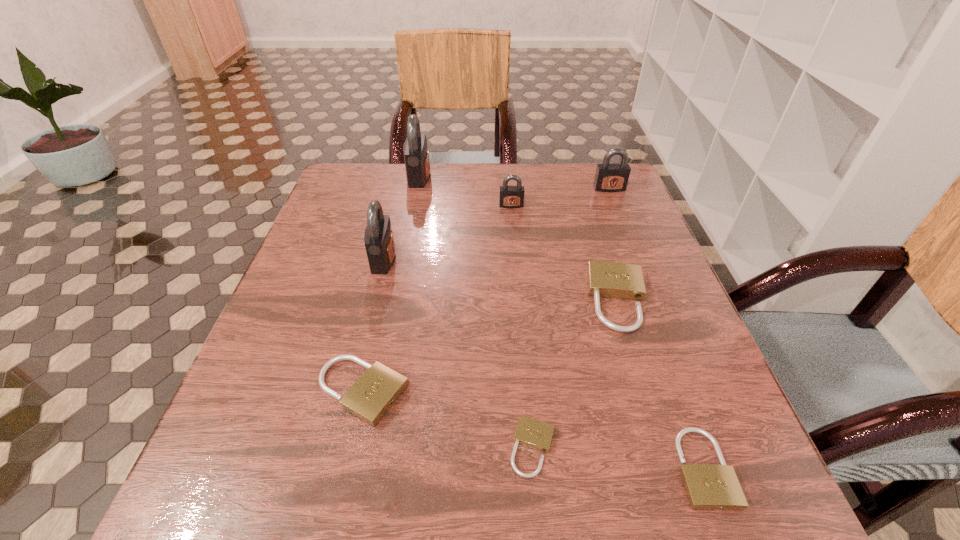
This screenshot has height=540, width=960. I want to click on vacant space at the far right corner, so click(608, 194).

What are the coordinates of `vacant area between the biggest beige padlock and the third shortest padlock` in the screenshot? It's located at click(491, 346).

Find the location of a particular element. The width and height of the screenshot is (960, 540). free space between the third beige padlock from right to left and the seventh shortest object is located at coordinates (458, 353).

Where is `free point between the third tallest object and the biggest gray padlock`? This screenshot has width=960, height=540. free point between the third tallest object and the biggest gray padlock is located at coordinates pos(515,183).

Find the location of a particular element. unoccupied area between the nearest gray padlock and the farthest beige padlock is located at coordinates (501, 279).

In order to click on free space between the nearest gray padlock and the sixth nearest object in this screenshot , I will do `click(447, 232)`.

This screenshot has height=540, width=960. Find the location of `free spot between the tallest object and the fourth tallest padlock`. free spot between the tallest object and the fourth tallest padlock is located at coordinates (465, 191).

Locate an element on the screen. free space between the sixth shortest padlock and the third smallest beige padlock is located at coordinates (486, 290).

Where is `unoccupied area between the third biggest beige padlock and the fourth shortest object`? This screenshot has width=960, height=540. unoccupied area between the third biggest beige padlock and the fourth shortest object is located at coordinates (660, 383).

You are a GUI agent. You are given a task and a screenshot of the screen. Output one action in this format:
    pyautogui.click(x=<x>, y=<y>)
    Task: Click on the free space that is in between the third shortest padlock and the rightmost gray padlock
    The width and height of the screenshot is (960, 540).
    Given the screenshot: What is the action you would take?
    pyautogui.click(x=486, y=290)